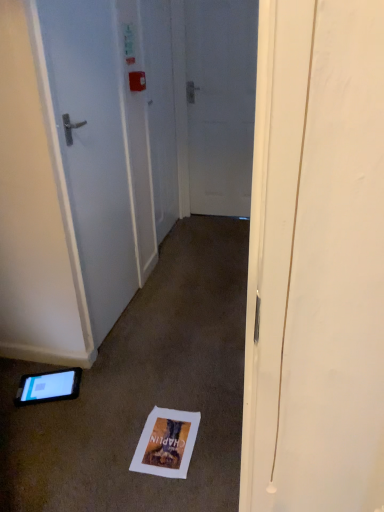
Question: In the image, is white glossy door at left, which is the second door in right-to-left order, positioned in front of or behind black glossy tablet at lower left?

Choices:
 (A) behind
 (B) front

Answer: (B)

Question: Based on their positions, is white glossy door at left, which is the second door in right-to-left order, located to the left or right of black glossy tablet at lower left?

Choices:
 (A) left
 (B) right

Answer: (B)

Question: Which is farther from the white paper postcard at lower center?

Choices:
 (A) black glossy tablet at lower left
 (B) white matte door at center, which is counted as the first door, starting from the back
 (C) white glossy door at left, marked as the 1th door in a front-to-back arrangement

Answer: (B)

Question: Based on their relative distances, which object is nearer to the white matte door at center, acting as the first door starting from the right?

Choices:
 (A) white paper postcard at lower center
 (B) black glossy tablet at lower left
 (C) white glossy door at left, marked as the 1th door in a front-to-back arrangement

Answer: (C)